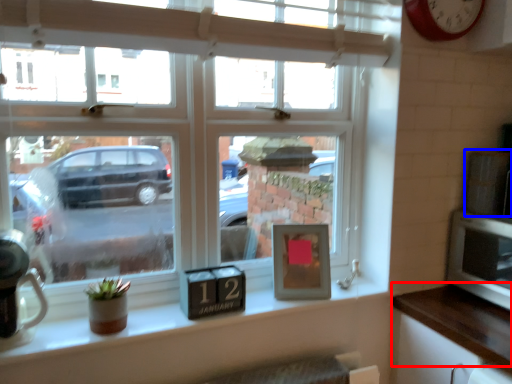
Question: Which point is further to the camera, counter top (highlighted by a red box) or appliance (highlighted by a blue box)?

Choices:
 (A) counter top
 (B) appliance

Answer: (B)